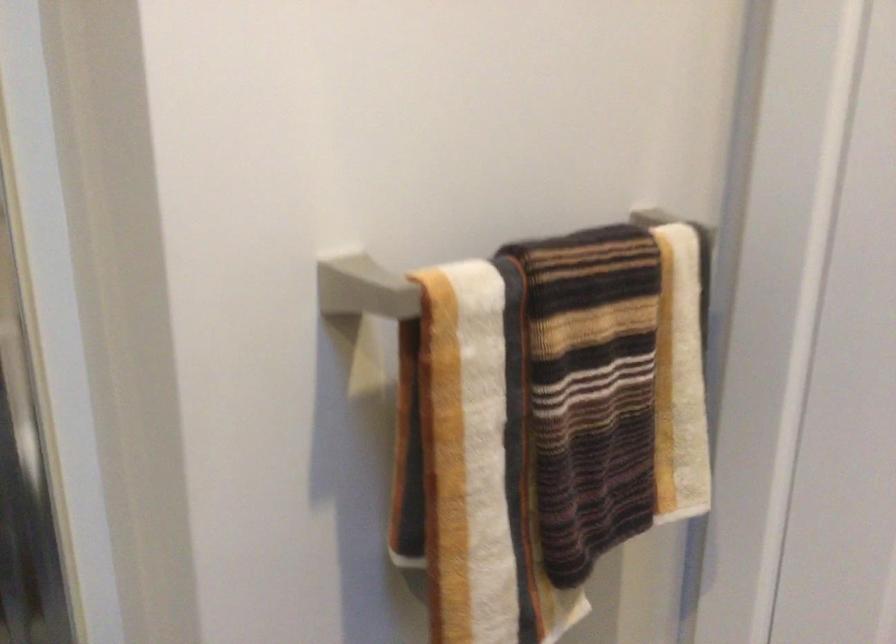
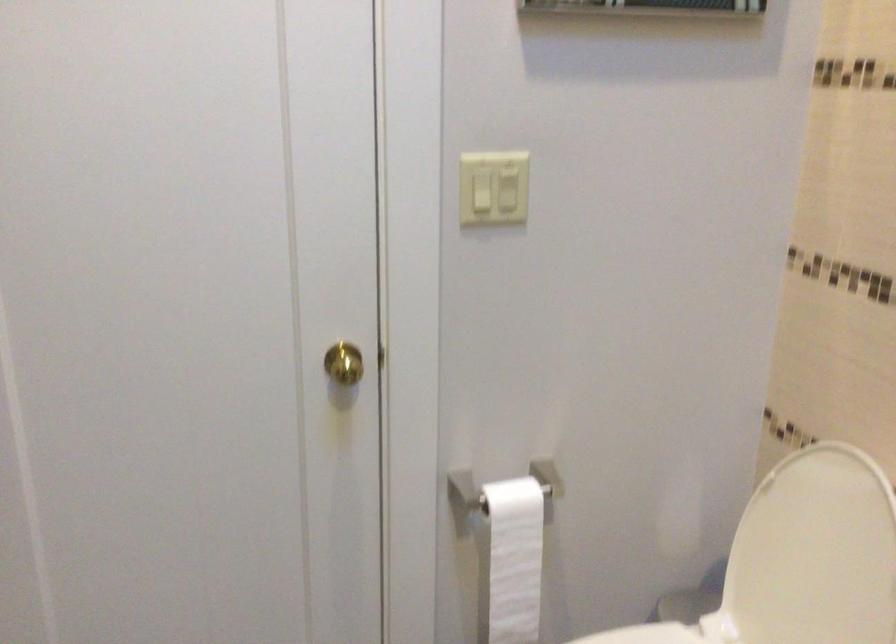
Question: The images are taken continuously from a first-person perspective. In which direction is your viewpoint rotating?

Choices:
 (A) Left
 (B) Right
 (C) Up
 (D) Down

Answer: (B)